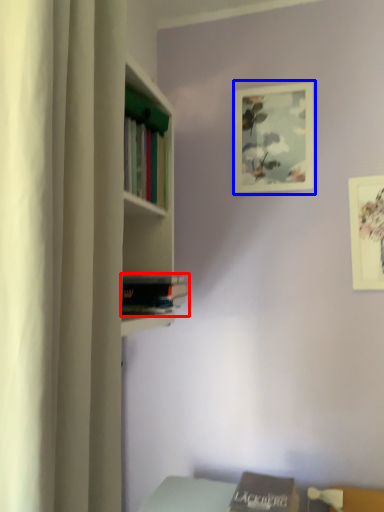
Question: Which object is further to the camera taking this photo, book (highlighted by a red box) or picture frame (highlighted by a blue box)?

Choices:
 (A) book
 (B) picture frame

Answer: (B)